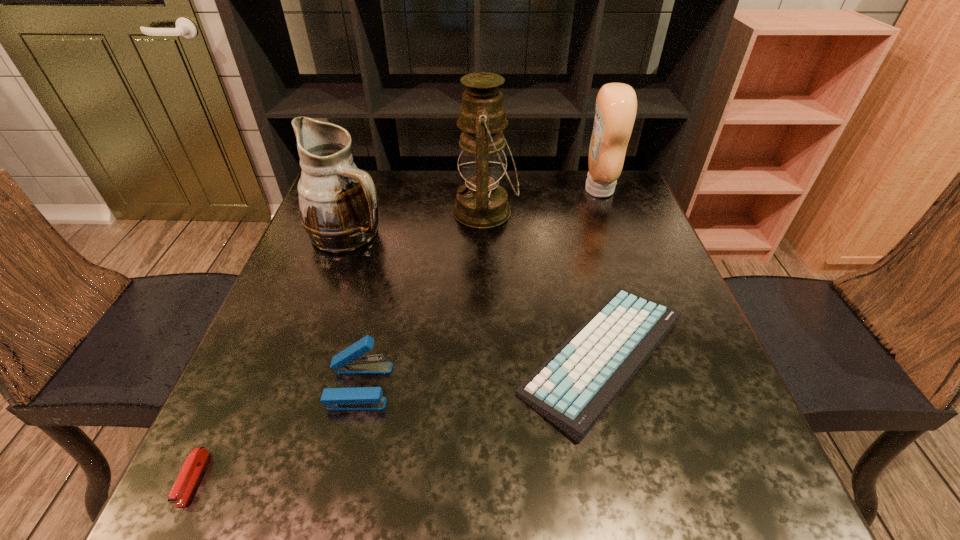
Identify the location of vacant region that satisfies the following two spatial constraints: 1. on the label of the condiment; 2. on the front side of the taller stapler. (x=670, y=386).

Locate an element on the screen. The height and width of the screenshot is (540, 960). vacant space that satisfies the following two spatial constraints: 1. from the spout of the pitcher; 2. on the right side of the fourth tallest object is located at coordinates (297, 386).

This screenshot has width=960, height=540. In order to click on free space that satisfies the following two spatial constraints: 1. from the spout of the pitcher; 2. on the left side of the taller stapler in this screenshot , I will do `click(297, 386)`.

Where is `free space that satisfies the following two spatial constraints: 1. on the label of the condiment; 2. on the front-facing side of the nearer stapler`? This screenshot has width=960, height=540. free space that satisfies the following two spatial constraints: 1. on the label of the condiment; 2. on the front-facing side of the nearer stapler is located at coordinates (704, 478).

At what (x,y) coordinates should I click in order to perform the action: click on vacant position in the image that satisfies the following two spatial constraints: 1. on the back side of the computer keyboard; 2. on the right side of the farther stapler. Please return your answer as a coordinate pair (x, y). Looking at the image, I should click on (367, 356).

I want to click on vacant space that satisfies the following two spatial constraints: 1. from the spout of the pitcher; 2. on the front-facing side of the left stapler, so click(x=264, y=478).

The image size is (960, 540). In order to click on vacant area in the image that satisfies the following two spatial constraints: 1. from the spout of the pitcher; 2. on the front-facing side of the nearest object in this screenshot , I will do `click(264, 478)`.